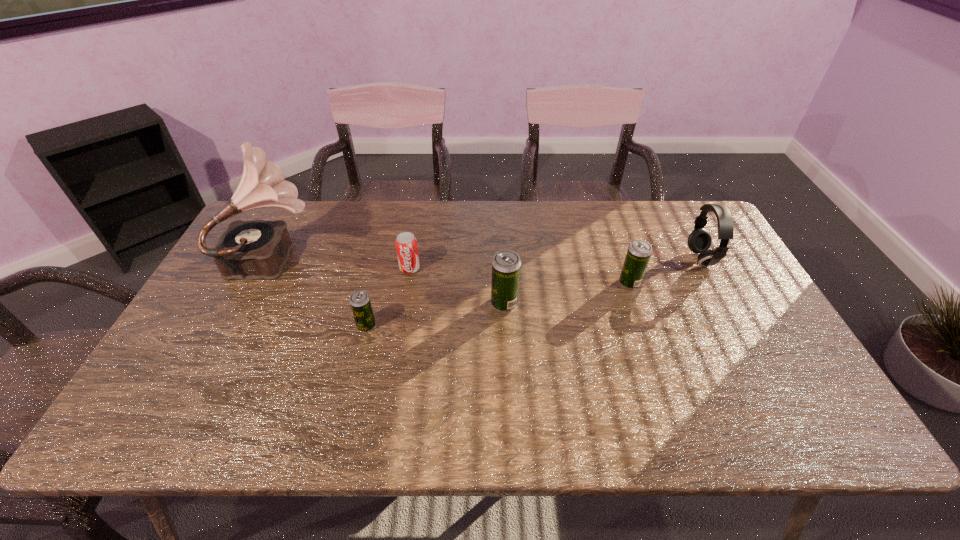
This screenshot has width=960, height=540. In order to click on vacant space at the far right corner of the desktop in this screenshot , I will do `click(656, 200)`.

This screenshot has width=960, height=540. Find the location of `vacant space at the near right corner of the desktop`. vacant space at the near right corner of the desktop is located at coordinates (792, 389).

Identify the location of empty location between the second nearest object and the tallest object. This screenshot has width=960, height=540. (390, 280).

The width and height of the screenshot is (960, 540). In order to click on vacant area that lies between the earphone and the tallest object in this screenshot , I will do `click(488, 258)`.

The width and height of the screenshot is (960, 540). I want to click on vacant area between the nearest beer can and the rightmost object, so click(534, 292).

What are the coordinates of `free space that is in between the second beer can from right to left and the farthest beer can` in the screenshot? It's located at (567, 293).

The width and height of the screenshot is (960, 540). Identify the location of free area in between the earphone and the second tallest beer can. (665, 271).

At what (x,y) coordinates should I click in order to perform the action: click on free area in between the second farthest beer can and the leftmost object. Please return your answer as a coordinate pair (x, y). This screenshot has height=540, width=960. Looking at the image, I should click on (390, 280).

I want to click on free space between the second beer can from left to right and the leftmost object, so click(390, 280).

The width and height of the screenshot is (960, 540). I want to click on vacant point located between the tallest beer can and the rightmost object, so click(602, 281).